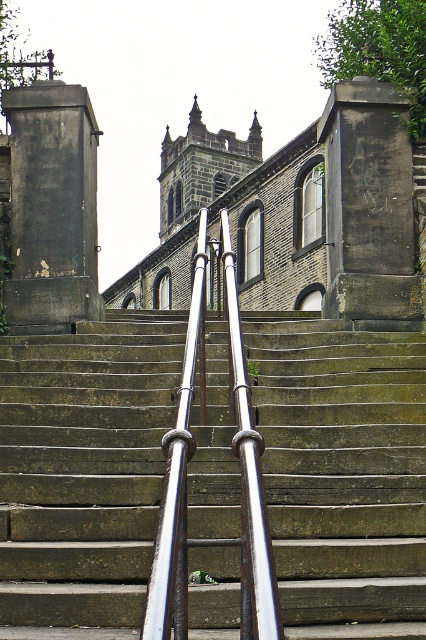
Question: Does rusty metal stairs at center have a larger size compared to silver metallic handrail at center?

Choices:
 (A) no
 (B) yes

Answer: (B)

Question: In this image, where is rusty metal stairs at center located relative to silver metallic handrail at center?

Choices:
 (A) below
 (B) above

Answer: (A)

Question: Can you confirm if rusty metal stairs at center is positioned to the left of silver metallic handrail at center?

Choices:
 (A) no
 (B) yes

Answer: (A)

Question: Which point is closer to the camera?

Choices:
 (A) silver metallic handrail at center
 (B) rusty metal stairs at center

Answer: (A)